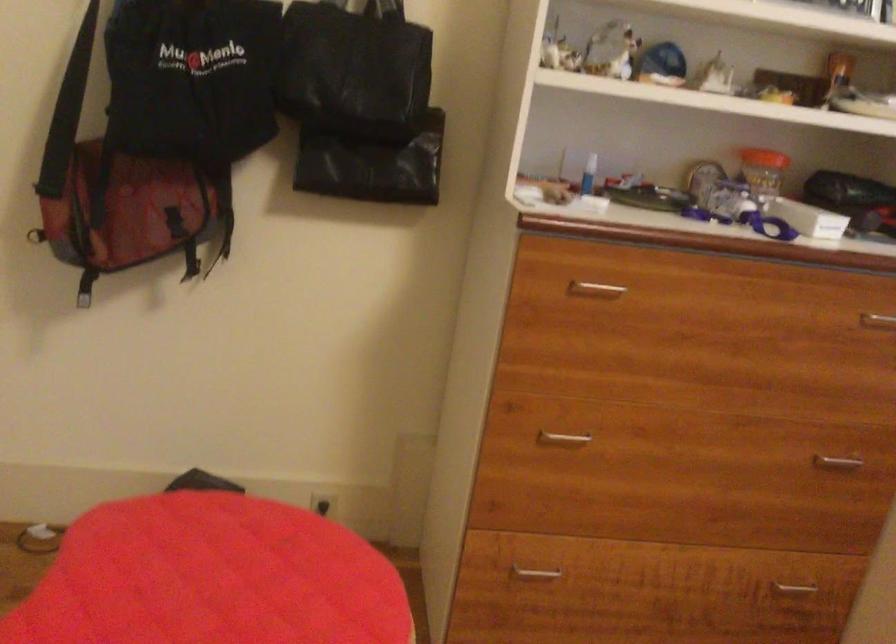
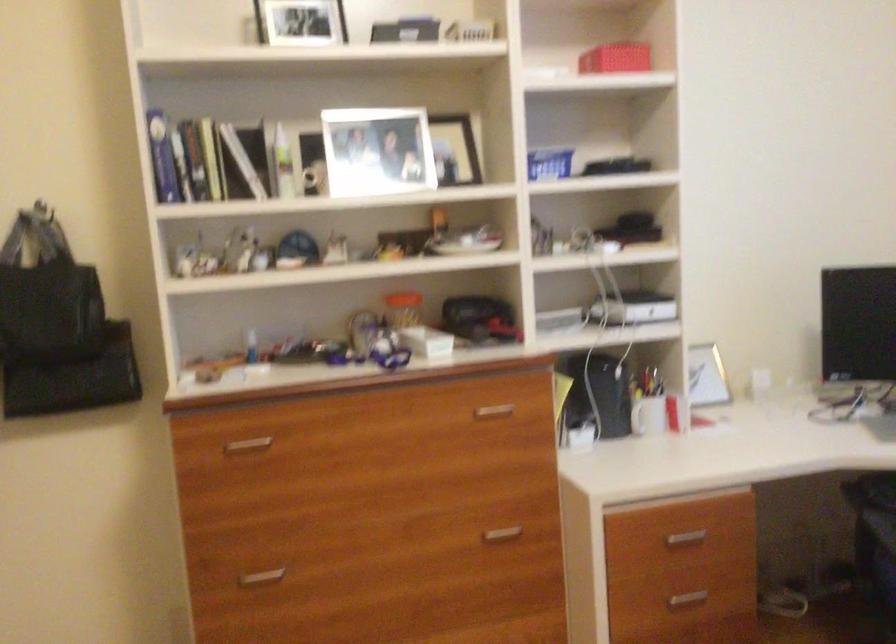
Question: The first image is from the beginning of the video and the second image is from the end. How did the camera likely rotate when shooting the video?

Choices:
 (A) Left
 (B) Right
 (C) Up
 (D) Down

Answer: (C)